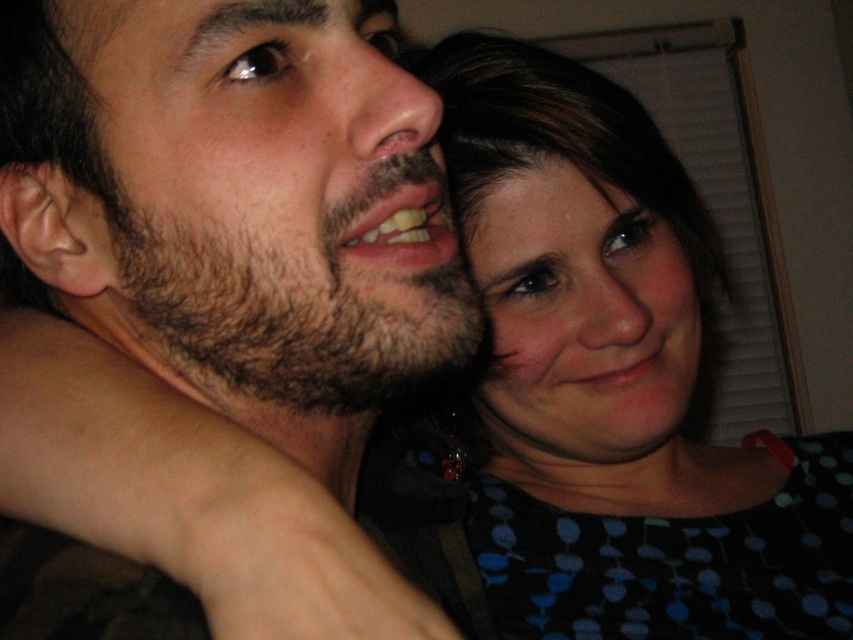
Based on the scene description, which object has a greater width between the dark brown hair at upper left and the matte black hair at upper right?

The dark brown hair at upper left has a greater width than the matte black hair at upper right according to the description.

You are a photographer adjusting the lighting in a studio. You need to ensure that the dark brown hair at upper left is evenly lit. Where should you place the light source relative to the subject?

The dark brown hair at upper left is located at coordinates point (236,205). To evenly light this area, position the light source opposite to its location, likely to the lower right of the subject.

From the picture: You are holding a small gift box that is 12 inches wide. You want to place it on the spot marked by the point at coordinates point (392, 243). Will the gift box fit entirely within the space available at that location?

The point (392, 243) is 14.34 inches from the viewer. Since the gift box is 12 inches wide, it will fit within the space available at that location as the distance is greater than the box width.